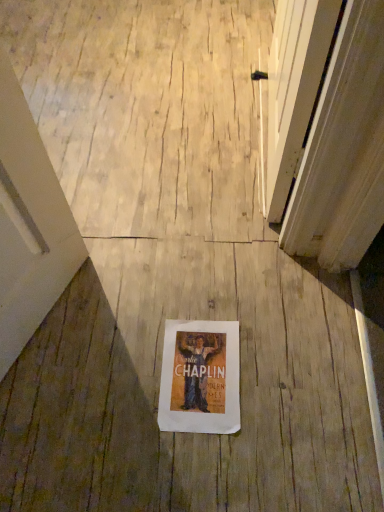
Locate an element on the screen. The image size is (384, 512). white paper poster at center is located at coordinates (200, 377).

This screenshot has height=512, width=384. What do you see at coordinates (200, 377) in the screenshot? I see `white paper poster at center` at bounding box center [200, 377].

Measure the distance between white paper poster at center and camera.

The distance of white paper poster at center from camera is 3.50 feet.

Locate an element on the screen. white paper poster at center is located at coordinates click(200, 377).